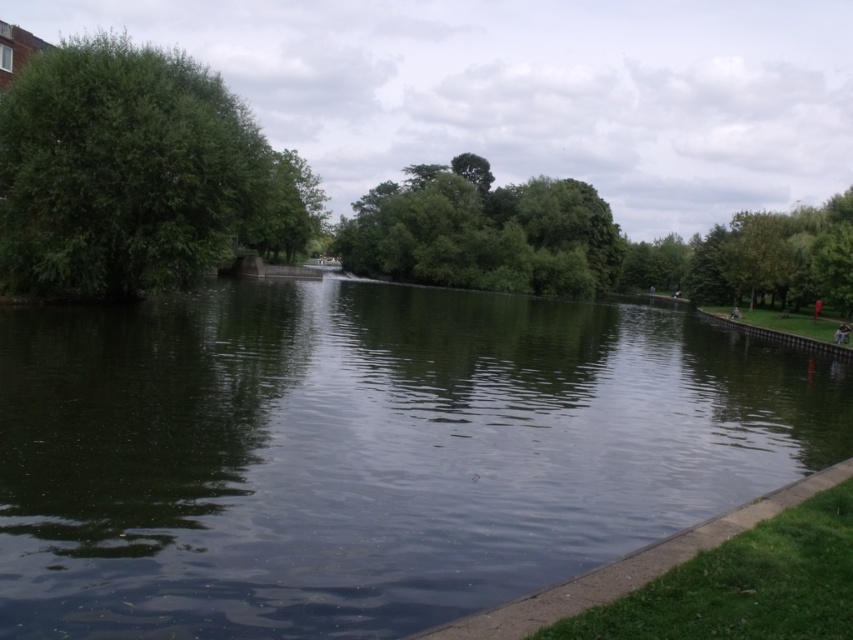
Is green leafy tree at left above green leafy trees at center?

Correct, green leafy tree at left is located above green leafy trees at center.

Who is taller, green leafy tree at left or green leafy trees at center?

Standing taller between the two is green leafy tree at left.

Does point (94, 118) lie in front of point (386, 225)?

Yes, it is.

This screenshot has width=853, height=640. I want to click on green leafy tree at left, so click(x=136, y=173).

Is point (383, 492) farther from camera compared to point (459, 230)?

That is False.

Does green reflective water at center have a larger size compared to green leafy trees at center?

Actually, green reflective water at center might be smaller than green leafy trees at center.

Is point (844, 387) in front of point (566, 204)?

Yes, it is.

Image resolution: width=853 pixels, height=640 pixels. I want to click on green reflective water at center, so click(x=369, y=452).

Does point (374, 444) come behind point (109, 182)?

No, it is not.

Does green reflective water at center lie in front of green leafy tree at left?

That is True.

Identify the location of green reflective water at center. (369, 452).

Locate an element on the screen. green reflective water at center is located at coordinates (369, 452).